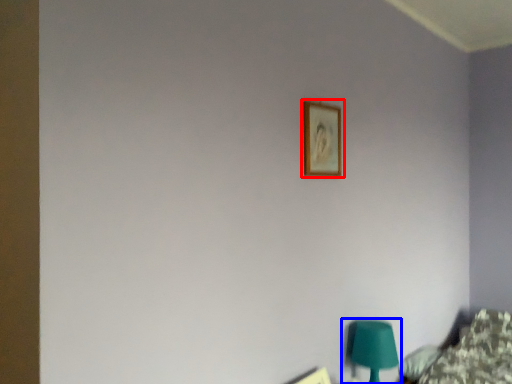
Question: Which of the following is the farthest to the observer, picture frame (highlighted by a red box) or table lamp (highlighted by a blue box)?

Choices:
 (A) picture frame
 (B) table lamp

Answer: (B)